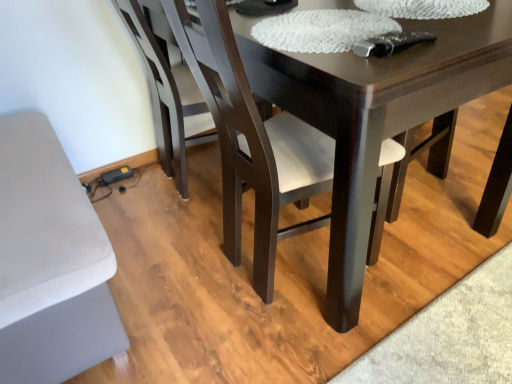
Question: From the image's perspective, does dark wood chair at center, positioned as the first chair in front-to-back order, appear lower than dark wood chair at lower left, which ranks as the first chair in back-to-front order?

Choices:
 (A) no
 (B) yes

Answer: (B)

Question: Is dark wood chair at center, positioned as the second chair in back-to-front order, smaller than dark wood chair at lower left, the 2th chair when ordered from front to back?

Choices:
 (A) yes
 (B) no

Answer: (B)

Question: Does dark wood chair at center, positioned as the first chair in front-to-back order, have a lesser height compared to dark wood chair at lower left, which ranks as the first chair in back-to-front order?

Choices:
 (A) yes
 (B) no

Answer: (B)

Question: Is dark wood chair at center, positioned as the second chair in back-to-front order, at the left side of dark wood chair at lower left, the 2th chair when ordered from front to back?

Choices:
 (A) yes
 (B) no

Answer: (B)

Question: Considering the relative positions of dark wood chair at center, positioned as the second chair in back-to-front order, and dark wood chair at lower left, the 2th chair when ordered from front to back, in the image provided, is dark wood chair at center, positioned as the second chair in back-to-front order, behind dark wood chair at lower left, the 2th chair when ordered from front to back,?

Choices:
 (A) yes
 (B) no

Answer: (B)

Question: Does dark wood chair at center, positioned as the second chair in back-to-front order, have a greater height compared to dark wood chair at lower left, which ranks as the first chair in back-to-front order?

Choices:
 (A) no
 (B) yes

Answer: (B)

Question: Can you confirm if dark wood chair at lower left, the 2th chair when ordered from front to back, is taller than dark wood chair at center, positioned as the second chair in back-to-front order?

Choices:
 (A) yes
 (B) no

Answer: (B)

Question: From the image's perspective, does dark wood chair at lower left, which ranks as the first chair in back-to-front order, appear lower than dark wood chair at center, positioned as the second chair in back-to-front order?

Choices:
 (A) no
 (B) yes

Answer: (A)

Question: Can you confirm if dark wood chair at lower left, the 2th chair when ordered from front to back, is positioned to the right of dark wood chair at center, positioned as the first chair in front-to-back order?

Choices:
 (A) yes
 (B) no

Answer: (B)

Question: Does dark wood chair at lower left, the 2th chair when ordered from front to back, have a lesser height compared to dark wood chair at center, positioned as the second chair in back-to-front order?

Choices:
 (A) yes
 (B) no

Answer: (A)

Question: Does dark wood chair at lower left, which ranks as the first chair in back-to-front order, have a lesser width compared to dark wood chair at center, positioned as the first chair in front-to-back order?

Choices:
 (A) yes
 (B) no

Answer: (A)

Question: Can you see dark wood chair at lower left, the 2th chair when ordered from front to back, touching dark wood chair at center, positioned as the second chair in back-to-front order?

Choices:
 (A) yes
 (B) no

Answer: (B)

Question: Is dark wood chair at lower left, the 2th chair when ordered from front to back, in front of or behind dark wood chair at center, positioned as the first chair in front-to-back order, in the image?

Choices:
 (A) behind
 (B) front

Answer: (A)